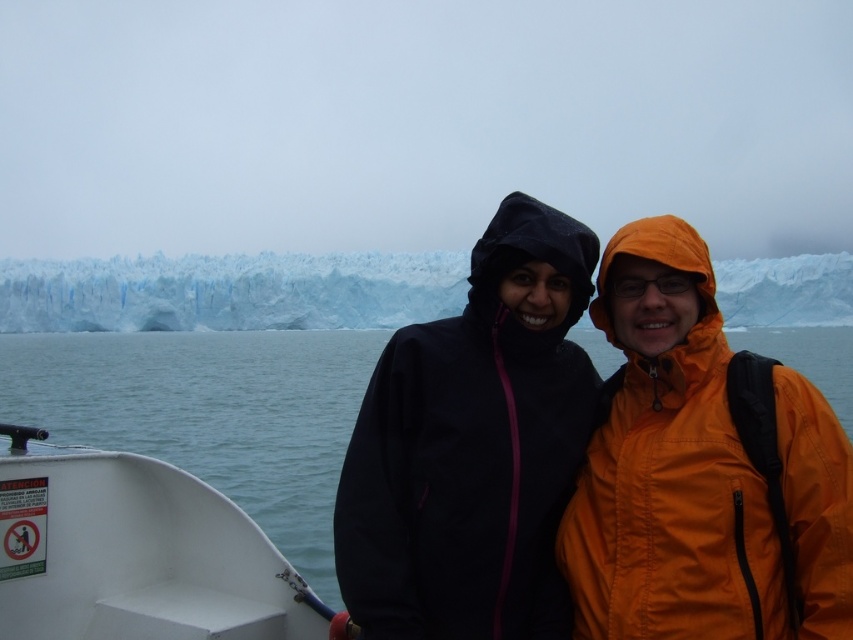
You are a photographer standing on the boat and want to take a photo of the glacier. You notice two points marked in the image. Which point, point (448, 528) or point (112, 636), is closer to you?

Point (448, 528) is closer to the camera than point (112, 636).

You are a photographer on a mission to capture the glacier in the background. You see the white matte boat at lower left and the white ice glacier at upper center. Which object is closer to you, the photographer?

The white matte boat at lower left is closer to you because it is positioned on the right side of the white ice glacier at upper center, which is further away in the scene.